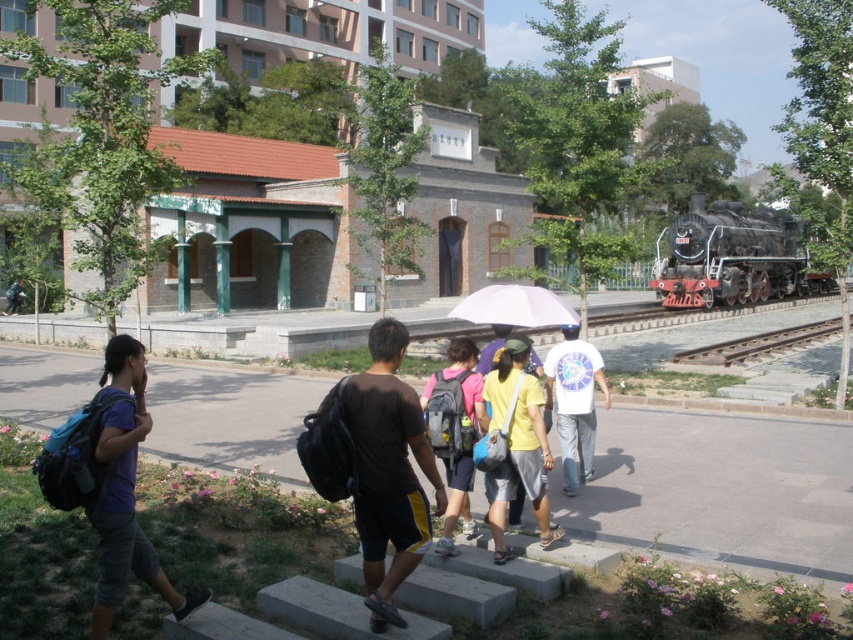
You are a delivery person trying to determine which backpack has more vertical space to fit a tall package. You see a black matte backpack at center and a matte pink backpack at center. Which one can accommodate a taller item?

The black matte backpack at center is much taller as matte pink backpack at center, so it can accommodate a taller item.

You are a pedestrian standing on the pathway near the railway track. You see a black matte backpack at center and a white matte umbrella at center. Which object is nearer to you?

The black matte backpack at center is closer to the viewer than the white matte umbrella at center.

You are a delivery person trying to navigate through the pathway. You see a black matte backpack at center and a matte pink backpack at center. Which backpack is positioned higher in the image?

The black matte backpack at center is positioned higher than the matte pink backpack at center in the image.